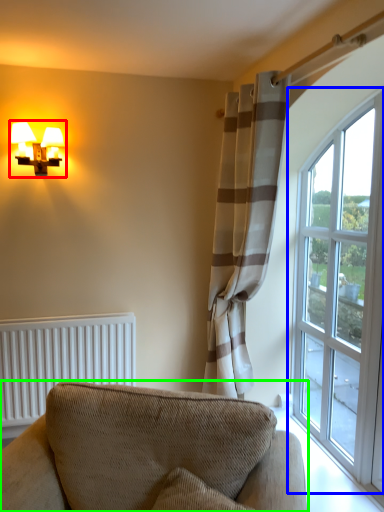
Question: Which object is positioned closest to table lamp (highlighted by a red box)? Select from window (highlighted by a blue box) and studio couch (highlighted by a green box).

Choices:
 (A) window
 (B) studio couch

Answer: (B)